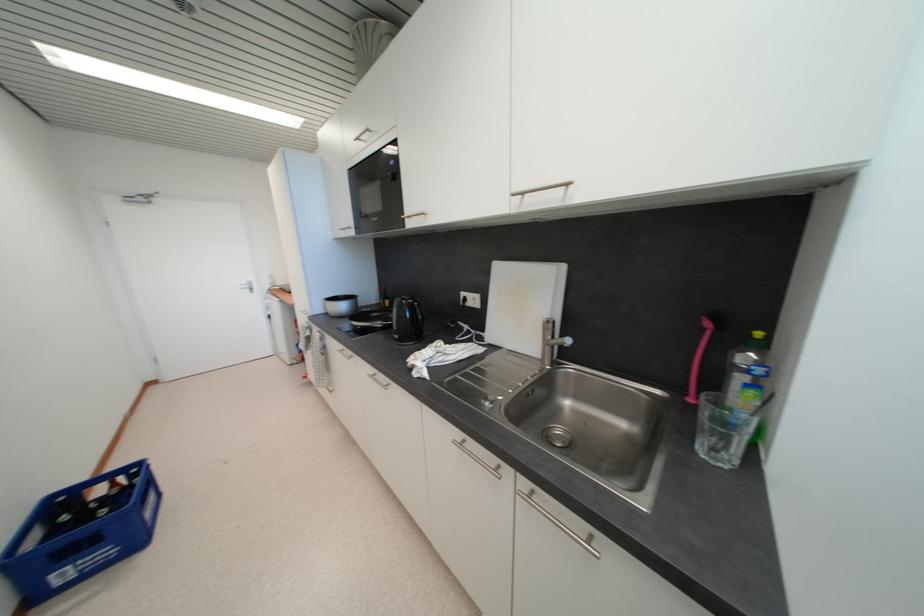
What do you see at coordinates (553, 517) in the screenshot? I see `the silver door handle` at bounding box center [553, 517].